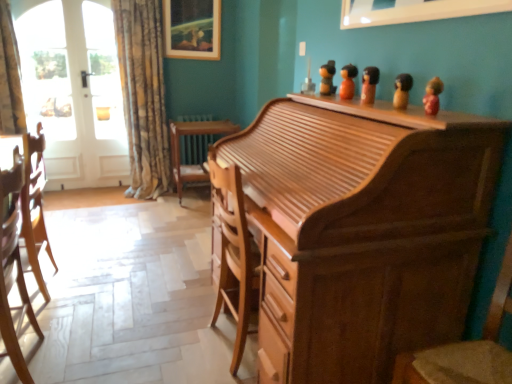
What are the coordinates of `light brown wood chair at left, which is counted as the 1th chair, starting from the back` in the screenshot? It's located at [x=13, y=268].

The width and height of the screenshot is (512, 384). Identify the location of wooden chair at center. (180, 150).

This screenshot has width=512, height=384. What do you see at coordinates (74, 91) in the screenshot?
I see `white glossy door at left` at bounding box center [74, 91].

Find the location of `textured beige curtain at left`. textured beige curtain at left is located at coordinates (143, 95).

Can you confirm if light brown wood chair at left, which is counted as the 1th chair, starting from the back, is smaller than wooden at right, the first chair in the front-to-back sequence?

Yes.

Is light brown wood chair at left, which is counted as the 1th chair, starting from the back, wider than wooden at right, the first chair in the front-to-back sequence?

No.

Does point (8, 290) come farther from viewer compared to point (473, 366)?

Yes, it is behind point (473, 366).

How distant is light brown wood chair at left, placed as the second chair when sorted from front to back, from wooden at right, the 2th chair positioned from the back?

light brown wood chair at left, placed as the second chair when sorted from front to back, and wooden at right, the 2th chair positioned from the back, are 1.63 meters apart from each other.

From the image's perspective, which one is positioned lower, textured beige curtain at left or light brown wood armchair at left?

From the image's view, light brown wood armchair at left is below.

Does point (127, 11) come in front of point (23, 211)?

No, it is behind (23, 211).

Is textured beige curtain at left smaller than light brown wood armchair at left?

No.

Considering the positions of points (478, 11) and (345, 168), is point (478, 11) closer to camera compared to point (345, 168)?

No, (478, 11) is behind (345, 168).

Considering the relative positions of white glossy picture frame at upper center, which appears as the second picture frame when viewed from the left, and wooden roll-top desk at center in the image provided, is white glossy picture frame at upper center, which appears as the second picture frame when viewed from the left, to the right of wooden roll-top desk at center from the viewer's perspective?

Correct, you'll find white glossy picture frame at upper center, which appears as the second picture frame when viewed from the left, to the right of wooden roll-top desk at center.

Based on the photo, between white glossy picture frame at upper center, which appears as the second picture frame when viewed from the left, and wooden roll-top desk at center, which one is positioned behind?

white glossy picture frame at upper center, which appears as the second picture frame when viewed from the left.

Are white glossy picture frame at upper center, which ranks as the second picture frame in back-to-front order, and wooden roll-top desk at center located far from each other?

No, white glossy picture frame at upper center, which ranks as the second picture frame in back-to-front order, is in close proximity to wooden roll-top desk at center.

Could you tell me if light brown wood armchair at left is facing white glossy picture frame at upper center, the 1th picture frame in the front-to-back sequence?

No.

Based on their positions, is light brown wood armchair at left located to the left or right of white glossy picture frame at upper center, which ranks as the second picture frame in back-to-front order?

light brown wood armchair at left is to the left of white glossy picture frame at upper center, which ranks as the second picture frame in back-to-front order.

From the image's perspective, between light brown wood armchair at left and white glossy picture frame at upper center, the 1th picture frame in the front-to-back sequence, which one is located above?

white glossy picture frame at upper center, the 1th picture frame in the front-to-back sequence, appears higher in the image.

Between light brown wood armchair at left and white glossy picture frame at upper center, which ranks as the second picture frame in back-to-front order, which one has larger width?

Wider between the two is light brown wood armchair at left.

From the image's perspective, is light brown wood armchair at left above or below wooden roll-top desk at center?

Clearly, from the image's perspective, light brown wood armchair at left is above wooden roll-top desk at center.

Which object is positioned more to the left, light brown wood armchair at left or wooden roll-top desk at center?

light brown wood armchair at left.

Consider the image. Can you confirm if light brown wood armchair at left is taller than wooden roll-top desk at center?

No.

Identify the location of cabinetry located on the right of light brown wood armchair at left. (362, 230).

Could you tell me if white glossy door at left is facing wooden roll-top desk at center?

No, white glossy door at left is not facing towards wooden roll-top desk at center.

What are the coordinates of `cabinetry in front of the white glossy door at left` in the screenshot? It's located at (362, 230).

Which is closer, (x=33, y=25) or (x=398, y=224)?

Point (x=33, y=25) is farther from the camera than point (x=398, y=224).

Does white glossy door at left lie in front of wooden roll-top desk at center?

No, white glossy door at left is behind wooden roll-top desk at center.

Is light brown wood chair at left, which is counted as the 1th chair, starting from the back, further to camera compared to wooden chair at center?

No, light brown wood chair at left, which is counted as the 1th chair, starting from the back, is closer to the camera.

How far apart are light brown wood chair at left, which is counted as the 1th chair, starting from the back, and wooden chair at center?

The distance of light brown wood chair at left, which is counted as the 1th chair, starting from the back, from wooden chair at center is 2.00 meters.

From the image's perspective, which is below, light brown wood chair at left, acting as the 2th chair starting from the right, or wooden chair at center?

light brown wood chair at left, acting as the 2th chair starting from the right.

Does light brown wood chair at left, the 1th chair from the left, turn towards wooden chair at center?

No, light brown wood chair at left, the 1th chair from the left, does not turn towards wooden chair at center.

Where is `chair behind the wooden at right, marked as the 1th chair in a right-to-left arrangement`? The height and width of the screenshot is (384, 512). chair behind the wooden at right, marked as the 1th chair in a right-to-left arrangement is located at coordinates (13, 268).

This screenshot has height=384, width=512. In the image, there is a textured beige curtain at left. What are the coordinates of `armchair below it (from the image's perspective)` in the screenshot? It's located at (35, 207).

Based on their spatial positions, is white glass door at left or white glossy door at left further from wooden picture frame at upper center, which appears as the 1th picture frame when viewed from the top?

The object further to wooden picture frame at upper center, which appears as the 1th picture frame when viewed from the top, is white glossy door at left.

Looking at the image, which one is located closer to light brown wood armchair at left, white glass door at left or wooden roll-top desk at center?

wooden roll-top desk at center is positioned closer to the anchor light brown wood armchair at left.

From the image, which object appears to be nearer to wooden picture frame at upper center, which appears as the 1th picture frame when viewed from the top, textured beige curtain at left or wooden at right, arranged as the 2th chair when viewed from the left?

textured beige curtain at left is positioned closer to the anchor wooden picture frame at upper center, which appears as the 1th picture frame when viewed from the top.

From the image, which object appears to be farther from wooden at right, arranged as the 2th chair when viewed from the left, textured beige curtain at left or white glossy picture frame at upper center, which ranks as the second picture frame in back-to-front order?

Based on the image, textured beige curtain at left appears to be further to wooden at right, arranged as the 2th chair when viewed from the left.

Which object lies further to the anchor point wooden roll-top desk at center, wooden chair at center or textured beige curtain at left?

textured beige curtain at left.

Looking at the image, which one is located further to white glossy door at left, light brown wood armchair at left or wooden chair at center?

light brown wood armchair at left is further to white glossy door at left.

When comparing their distances from white glass door at left, does light brown wood chair at left, which is counted as the 1th chair, starting from the back, or wooden at right, arranged as the 2th chair when viewed from the left, seem closer?

light brown wood chair at left, which is counted as the 1th chair, starting from the back, lies closer to white glass door at left than the other object.

Based on the photo, looking at the image, which one is located further to white glossy picture frame at upper center, the 1th picture frame in the front-to-back sequence, wooden at right, the 2th chair positioned from the back, or wooden chair at center?

The object further to white glossy picture frame at upper center, the 1th picture frame in the front-to-back sequence, is wooden chair at center.

The width and height of the screenshot is (512, 384). Identify the location of curtain located between wooden roll-top desk at center and wooden chair at center in the depth direction. (143, 95).

The width and height of the screenshot is (512, 384). Find the location of `picture frame positioned between wooden at right, the first chair in the front-to-back sequence, and white glossy door at left from near to far`. picture frame positioned between wooden at right, the first chair in the front-to-back sequence, and white glossy door at left from near to far is located at coordinates [x=413, y=10].

I want to click on armchair between white glossy picture frame at upper center, which ranks as the second picture frame in back-to-front order, and white glass door at left from front to back, so click(x=35, y=207).

Find the location of `armchair between white glossy picture frame at upper center, which is the first picture frame in bottom-to-top order, and textured beige curtain at left in the front-back direction`. armchair between white glossy picture frame at upper center, which is the first picture frame in bottom-to-top order, and textured beige curtain at left in the front-back direction is located at coordinates (35, 207).